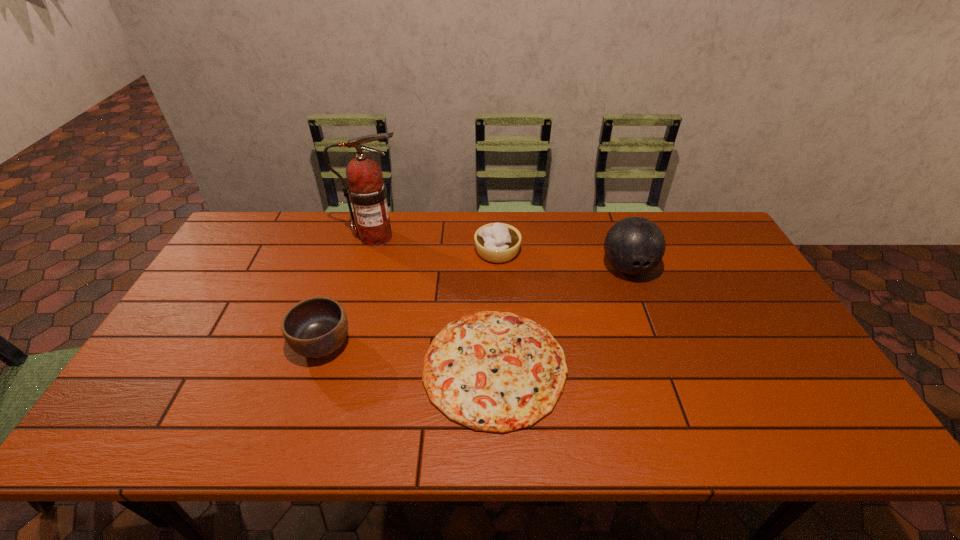
At what (x,y) coordinates should I click in order to perform the action: click on free space located on the right of the shortest object. Please return your answer as a coordinate pair (x, y). The image size is (960, 540). Looking at the image, I should click on (618, 367).

At what (x,y) coordinates should I click in order to perform the action: click on fire extinguisher at the far edge. Please return your answer as a coordinate pair (x, y). Looking at the image, I should click on (366, 190).

Identify the location of bowling ball present at the far edge. click(x=635, y=245).

Image resolution: width=960 pixels, height=540 pixels. In order to click on whipped cream located at the far edge in this screenshot , I will do `click(496, 242)`.

You are a GUI agent. You are given a task and a screenshot of the screen. Output one action in this format:
    pyautogui.click(x=<x>, y=<y>)
    Task: Click on the object at the near edge
    This screenshot has height=540, width=960.
    Given the screenshot: What is the action you would take?
    pyautogui.click(x=491, y=371)

Where is `vacant space at the far edge of the desktop`? vacant space at the far edge of the desktop is located at coordinates (682, 251).

In the image, there is a desktop. Where is `vacant area at the near edge`? This screenshot has height=540, width=960. vacant area at the near edge is located at coordinates (646, 424).

Identify the location of vacant space at the left edge. (236, 264).

At what (x,y) coordinates should I click in order to perform the action: click on vacant space at the right edge. Please return your answer as a coordinate pair (x, y). Looking at the image, I should click on (812, 369).

Where is `free space at the far left corner`? free space at the far left corner is located at coordinates (281, 219).